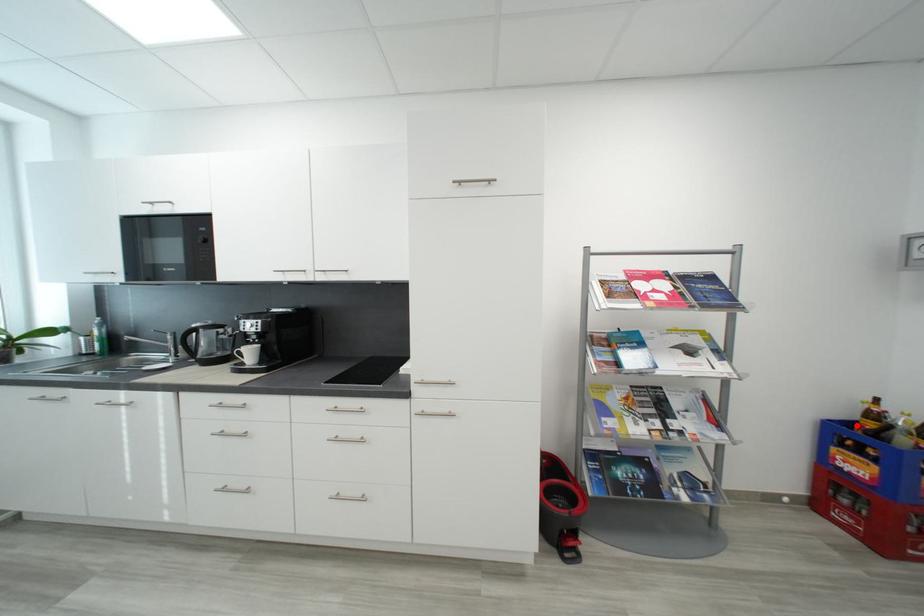
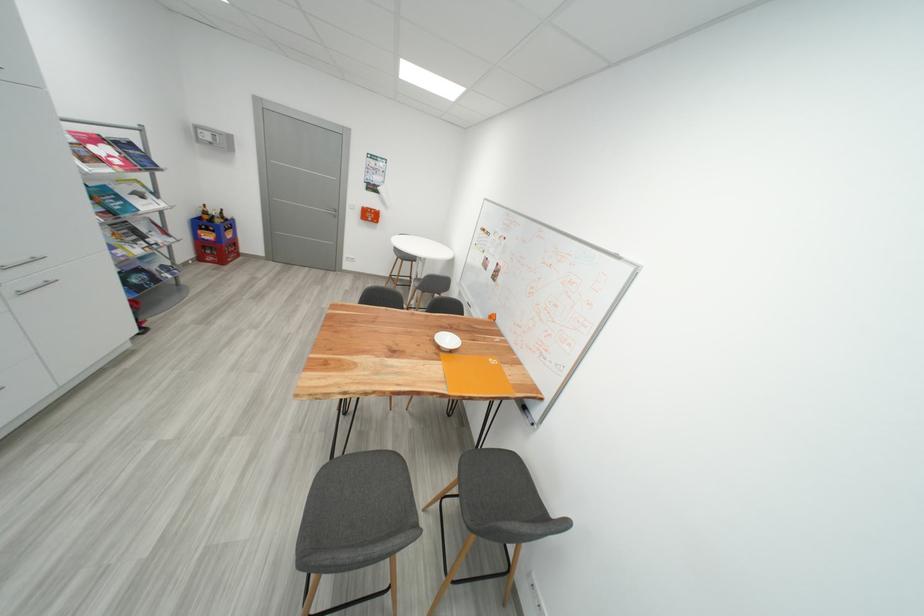
In the second image, find the point that corresponds to the highlighted location in the first image.

(208, 220)